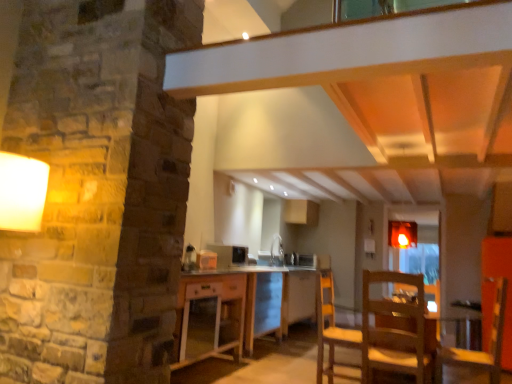
Describe the element at coordinates (273, 253) in the screenshot. The height and width of the screenshot is (384, 512). I see `white glossy sink at center` at that location.

Locate an element on the screen. white glossy sink at center is located at coordinates 273,253.

In order to face white glossy microwave at center, which ranks as the 1th appliance in bottom-to-top order, should I rotate leftwards or rightwards?

Turn right by 6.865 degrees to look at white glossy microwave at center, which ranks as the 1th appliance in bottom-to-top order.

What do you see at coordinates (229, 254) in the screenshot?
I see `satin black microwave at center, marked as the 1th appliance in a front-to-back arrangement` at bounding box center [229, 254].

Where is `wooden chair at lower right, placed as the first chair when sorted from right to left`? wooden chair at lower right, placed as the first chair when sorted from right to left is located at coordinates (377, 332).

Image resolution: width=512 pixels, height=384 pixels. What do you see at coordinates (332, 330) in the screenshot? I see `wooden chair at lower right, the 1th chair from the left` at bounding box center [332, 330].

Locate an element on the screen. Image resolution: width=512 pixels, height=384 pixels. white glossy sink at center is located at coordinates (273, 253).

Considering the relative sizes of wooden table at center and wooden chair at lower right, the 1th chair from the left, in the image provided, is wooden table at center thinner than wooden chair at lower right, the 1th chair from the left,?

In fact, wooden table at center might be wider than wooden chair at lower right, the 1th chair from the left.

Identify the location of table located underneath the wooden chair at lower right, the 1th chair from the left (from a real-world perspective). pyautogui.click(x=246, y=304).

Considering the relative sizes of wooden table at center and wooden chair at lower right, which appears as the second chair when viewed from the right, in the image provided, is wooden table at center smaller than wooden chair at lower right, which appears as the second chair when viewed from the right,?

No, wooden table at center is not smaller than wooden chair at lower right, which appears as the second chair when viewed from the right.

Considering the relative positions of wooden table at center and wooden chair at lower right, which appears as the second chair when viewed from the right, in the image provided, is wooden table at center to the left or to the right of wooden chair at lower right, which appears as the second chair when viewed from the right,?

From the image, it's evident that wooden table at center is to the left of wooden chair at lower right, which appears as the second chair when viewed from the right.

How different are the orientations of satin black microwave at center, which appears as the 2th appliance when viewed from the back, and transparent glass door at center in degrees?

They differ by 90.4 degrees in their facing directions.

Considering the sizes of objects satin black microwave at center, which appears as the 2th appliance when viewed from the back, and transparent glass door at center in the image provided, who is smaller, satin black microwave at center, which appears as the 2th appliance when viewed from the back, or transparent glass door at center?

Smaller between the two is satin black microwave at center, which appears as the 2th appliance when viewed from the back.

From a real-world perspective, which is physically above, satin black microwave at center, which appears as the 2th appliance when viewed from the back, or transparent glass door at center?

transparent glass door at center is physically above.

Do you think satin black microwave at center, arranged as the second appliance when ordered from the bottom, is within transparent glass door at center, or outside of it?

satin black microwave at center, arranged as the second appliance when ordered from the bottom, is spatially situated outside transparent glass door at center.

Considering the relative sizes of transparent glass door at center and wooden table at center in the image provided, is transparent glass door at center bigger than wooden table at center?

Incorrect, transparent glass door at center is not larger than wooden table at center.

From the picture: From the image's perspective, relative to wooden table at center, is transparent glass door at center above or below?

From the image's perspective, transparent glass door at center appears above wooden table at center.

Considering the relative sizes of transparent glass door at center and wooden table at center in the image provided, is transparent glass door at center thinner than wooden table at center?

Yes, transparent glass door at center is thinner than wooden table at center.

Which of these two, white glossy sink at center or transparent glass door at center, is wider?

With larger width is white glossy sink at center.

Are white glossy sink at center and transparent glass door at center far apart?

Absolutely, white glossy sink at center is distant from transparent glass door at center.

I want to click on sink below the transparent glass door at center (from a real-world perspective), so click(273, 253).

Is white glossy sink at center to the right of white glossy microwave at center, placed as the 2th appliance when sorted from left to right, from the viewer's perspective?

No, white glossy sink at center is not to the right of white glossy microwave at center, placed as the 2th appliance when sorted from left to right.

Is white glossy sink at center behind white glossy microwave at center, positioned as the 2th appliance in front-to-back order?

No, it is not.

Is white glossy sink at center inside the boundaries of white glossy microwave at center, placed as the 2th appliance when sorted from left to right, or outside?

The correct answer is: outside.

Does white glossy microwave at center, placed as the 1th appliance when sorted from right to left, have a lesser width compared to transparent glass door at center?

No, white glossy microwave at center, placed as the 1th appliance when sorted from right to left, is not thinner than transparent glass door at center.

Can you tell me how much white glossy microwave at center, placed as the 2th appliance when sorted from left to right, and transparent glass door at center differ in facing direction?

91.5 degrees separate the facing orientations of white glossy microwave at center, placed as the 2th appliance when sorted from left to right, and transparent glass door at center.

Which object is closer to the camera taking this photo, white glossy microwave at center, positioned as the 2th appliance in front-to-back order, or transparent glass door at center?

transparent glass door at center.

Locate an element on the screen. Image resolution: width=512 pixels, height=384 pixels. appliance behind the transparent glass door at center is located at coordinates (307, 260).

What's the angular difference between satin black microwave at center, arranged as the second appliance when ordered from the bottom, and white glossy sink at center's facing directions?

The angle between the facing direction of satin black microwave at center, arranged as the second appliance when ordered from the bottom, and the facing direction of white glossy sink at center is 41.4 degrees.

Measure the distance between satin black microwave at center, which appears as the 2th appliance when viewed from the back, and white glossy sink at center.

38.22 inches.

Is there a large distance between satin black microwave at center, the second appliance from the right, and white glossy sink at center?

No.

Is satin black microwave at center, marked as the 1th appliance in a front-to-back arrangement, oriented towards white glossy sink at center?

No, satin black microwave at center, marked as the 1th appliance in a front-to-back arrangement, does not turn towards white glossy sink at center.

Locate an element on the screen. Image resolution: width=512 pixels, height=384 pixels. table below the wooden chair at lower right, which appears as the second chair when viewed from the right (from the image's perspective) is located at coordinates (246, 304).

Image resolution: width=512 pixels, height=384 pixels. I want to click on glass door on the right of satin black microwave at center, which appears as the first appliance when viewed from the left, so coord(419,254).

Looking at the image, which one is located further to transparent glass door at center, white glossy sink at center or wooden chair at lower right, which is counted as the second chair, starting from the left?

wooden chair at lower right, which is counted as the second chair, starting from the left, is positioned further to the anchor transparent glass door at center.

Considering their positions, is wooden table at center positioned further to white glossy microwave at center, which ranks as the 1th appliance in bottom-to-top order, than satin black microwave at center, arranged as the second appliance when ordered from the bottom?

The object further to white glossy microwave at center, which ranks as the 1th appliance in bottom-to-top order, is satin black microwave at center, arranged as the second appliance when ordered from the bottom.

Considering their positions, is wooden chair at lower right, the 1th chair from the left, positioned further to satin black microwave at center, which appears as the first appliance when viewed from the left, than wooden chair at lower right, placed as the first chair when sorted from right to left?

wooden chair at lower right, placed as the first chair when sorted from right to left.

Looking at the image, which one is located further to transparent glass door at center, white glossy microwave at center, which ranks as the 1th appliance in bottom-to-top order, or white glossy sink at center?

white glossy sink at center is positioned further to the anchor transparent glass door at center.

Looking at the image, which one is located further to white glossy microwave at center, positioned as the 2th appliance in front-to-back order, transparent glass door at center or white glossy sink at center?

transparent glass door at center.

Which object lies further to the anchor point white glossy microwave at center, positioned as the 2th appliance in front-to-back order, transparent glass door at center or wooden table at center?

Among the two, transparent glass door at center is located further to white glossy microwave at center, positioned as the 2th appliance in front-to-back order.

Considering their positions, is satin black microwave at center, marked as the 1th appliance in a front-to-back arrangement, positioned closer to wooden table at center than white glossy sink at center?

The object closer to wooden table at center is satin black microwave at center, marked as the 1th appliance in a front-to-back arrangement.

Considering their positions, is white glossy sink at center positioned closer to wooden chair at lower right, which appears as the second chair when viewed from the right, than transparent glass door at center?

white glossy sink at center.

You are a GUI agent. You are given a task and a screenshot of the screen. Output one action in this format:
    pyautogui.click(x=<x>, y=<y>)
    Task: Click on the sink between wooden chair at lower right, which appears as the second chair when viewed from the right, and transparent glass door at center in the front-back direction
    
    Given the screenshot: What is the action you would take?
    pyautogui.click(x=273, y=253)

The height and width of the screenshot is (384, 512). I want to click on sink between wooden table at center and transparent glass door at center in the horizontal direction, so click(273, 253).

Where is `sink positioned between wooden chair at lower right, which is counted as the second chair, starting from the left, and transparent glass door at center from near to far`? sink positioned between wooden chair at lower right, which is counted as the second chair, starting from the left, and transparent glass door at center from near to far is located at coordinates (273, 253).

Identify the location of chair located between wooden chair at lower right, which is counted as the second chair, starting from the left, and white glossy microwave at center, positioned as the second appliance in top-to-bottom order, in the depth direction. This screenshot has height=384, width=512. (332, 330).